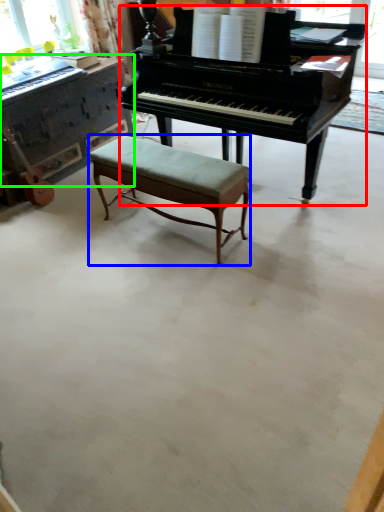
Question: Considering the real-world distances, which object is farthest from piano (highlighted by a red box)? stool (highlighted by a blue box) or piano (highlighted by a green box)?

Choices:
 (A) stool
 (B) piano

Answer: (B)